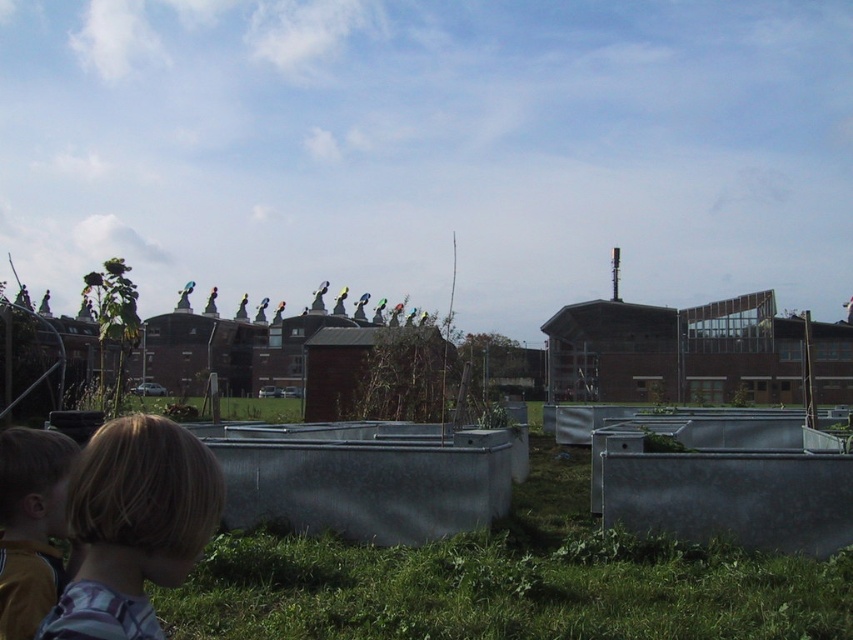
Question: Is blonde hair at lower left to the left of yellow jersey at lower left from the viewer's perspective?

Choices:
 (A) no
 (B) yes

Answer: (A)

Question: Which of the following is the farthest from the observer?

Choices:
 (A) (51, 513)
 (B) (125, 554)

Answer: (A)

Question: Can you confirm if blonde hair at lower left is smaller than yellow jersey at lower left?

Choices:
 (A) no
 (B) yes

Answer: (A)

Question: Does blonde hair at lower left lie behind yellow jersey at lower left?

Choices:
 (A) no
 (B) yes

Answer: (A)